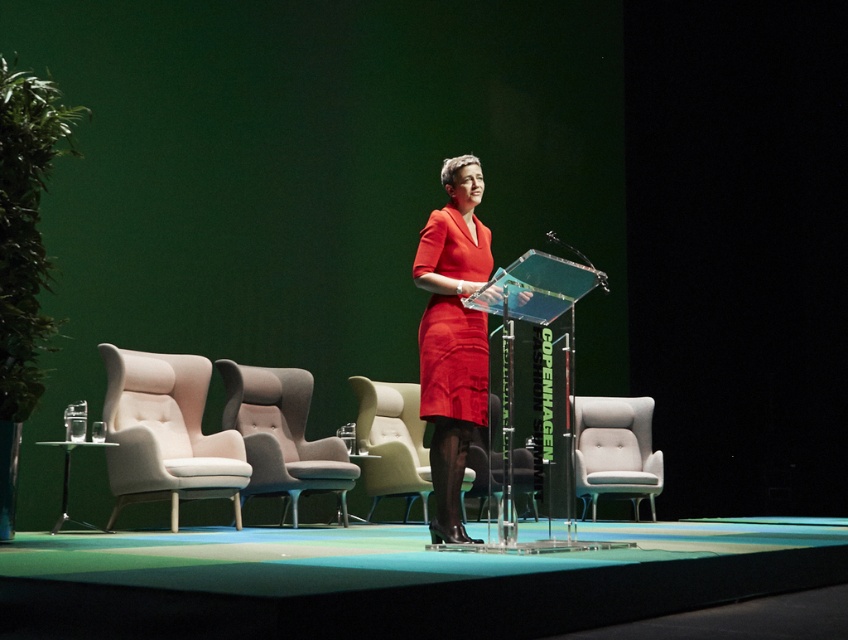
Does point (644, 412) lie in front of point (356, 429)?

No, it is not.

Is light gray fabric wingback chair at center smaller than matte beige chair at center?

Indeed, light gray fabric wingback chair at center has a smaller size compared to matte beige chair at center.

Who is more distant from viewer, [632,442] or [400,484]?

Point [632,442]

You are a GUI agent. You are given a task and a screenshot of the screen. Output one action in this format:
    pyautogui.click(x=<x>, y=<y>)
    Task: Click on the light gray fabric wingback chair at center
    The width and height of the screenshot is (848, 640).
    Given the screenshot: What is the action you would take?
    pyautogui.click(x=615, y=451)

Does beige fabric armchair at left have a smaller size compared to light gray fabric wingback chair at center?

Actually, beige fabric armchair at left might be larger than light gray fabric wingback chair at center.

From the picture: Does beige fabric armchair at left appear on the left side of light gray fabric wingback chair at center?

Correct, you'll find beige fabric armchair at left to the left of light gray fabric wingback chair at center.

Between point (153, 368) and point (604, 486), which one is positioned behind?

Point (604, 486)

This screenshot has height=640, width=848. I want to click on beige fabric armchair at left, so click(x=166, y=433).

Can you confirm if matte red dress at center is thinner than light beige fabric armchair at center?

Incorrect, matte red dress at center's width is not less than light beige fabric armchair at center's.

Which of these two, matte red dress at center or light beige fabric armchair at center, stands taller?

Standing taller between the two is matte red dress at center.

Image resolution: width=848 pixels, height=640 pixels. I want to click on matte red dress at center, so click(x=452, y=337).